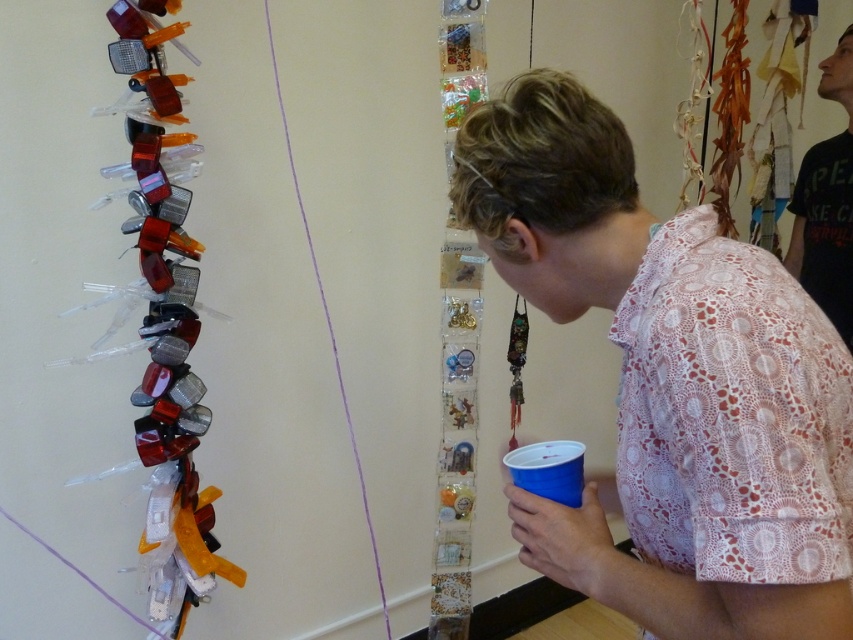
Question: From the image, what is the correct spatial relationship of pink lace shirt at center in relation to black cotton shirt at upper right?

Choices:
 (A) below
 (B) above

Answer: (A)

Question: Where is pink lace shirt at center located in relation to black cotton shirt at upper right in the image?

Choices:
 (A) right
 (B) left

Answer: (B)

Question: Which point is closer to the camera?

Choices:
 (A) pink lace shirt at center
 (B) black cotton shirt at upper right

Answer: (A)

Question: Does pink lace shirt at center come in front of black cotton shirt at upper right?

Choices:
 (A) yes
 (B) no

Answer: (A)

Question: Among these points, which one is farthest from the camera?

Choices:
 (A) coord(817,243)
 (B) coord(677,509)

Answer: (A)